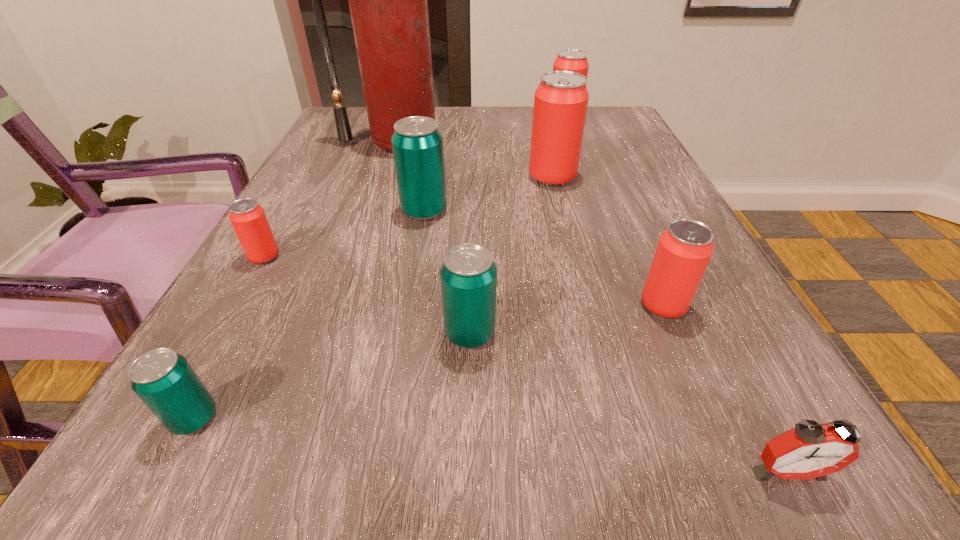
I want to click on fire extinguisher, so click(x=388, y=4).

Locate an element on the screen. red fire extinguisher is located at coordinates (388, 4).

Identify the location of the second farthest red beer can. (560, 105).

Locate an element on the screen. This screenshot has width=960, height=540. the second farthest beer can is located at coordinates (560, 105).

Find the location of a particular element. the third smallest red beer can is located at coordinates (574, 60).

The width and height of the screenshot is (960, 540). I want to click on the farthest red beer can, so [x=574, y=60].

Where is `the second teal beer can from right to left`? the second teal beer can from right to left is located at coordinates (418, 150).

Locate an element on the screen. This screenshot has height=540, width=960. the biggest teal beer can is located at coordinates (418, 150).

This screenshot has width=960, height=540. Find the location of `the third biggest red beer can`. the third biggest red beer can is located at coordinates (684, 250).

Where is `the fourth beer can from left to right`? The image size is (960, 540). the fourth beer can from left to right is located at coordinates (468, 274).